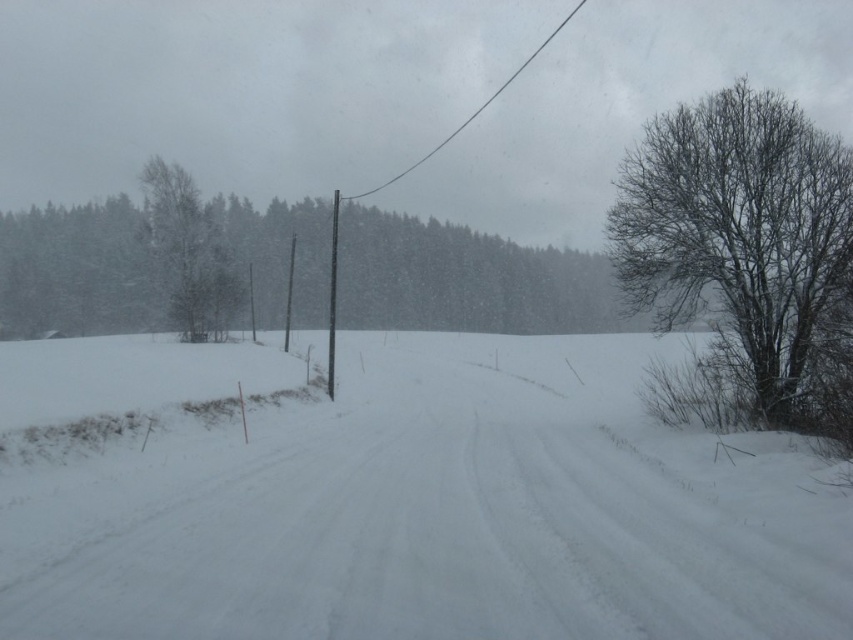
Is point (444, 444) positioned behind point (212, 260)?

No, it is in front of (212, 260).

Which is behind, point (488, 502) or point (184, 266)?

Positioned behind is point (184, 266).

Is point (405, 433) behind point (183, 180)?

No, it is in front of (183, 180).

The height and width of the screenshot is (640, 853). In order to click on white powdery snow at center in this screenshot , I will do `click(437, 515)`.

Identify the location of bare branches at right. The width and height of the screenshot is (853, 640). (746, 244).

How distant is bare branches at right from smooth gray pole at center?

bare branches at right is 93.10 feet from smooth gray pole at center.

In order to click on bare branches at right in this screenshot , I will do point(746,244).

Does green textured tree at left have a lesser height compared to black wire at upper center?

Indeed, green textured tree at left has a lesser height compared to black wire at upper center.

Based on the photo, can you confirm if green textured tree at left is positioned below black wire at upper center?

Yes.

Who is more distant from viewer, [155,253] or [444,138]?

The point [444,138] is behind.

Find the location of a particular element. The height and width of the screenshot is (640, 853). green textured tree at left is located at coordinates (189, 252).